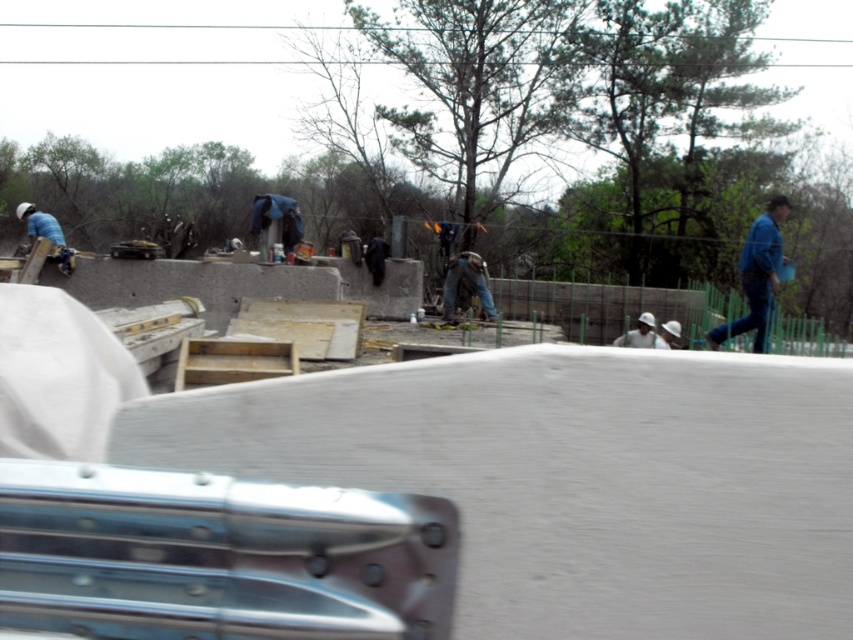
Between smooth concrete at center and blue denim jeans at right, which one appears on the left side from the viewer's perspective?

smooth concrete at center

You are a GUI agent. You are given a task and a screenshot of the screen. Output one action in this format:
    pyautogui.click(x=<x>, y=<y>)
    Task: Click on the smooth concrete at center
    The height and width of the screenshot is (640, 853).
    Given the screenshot: What is the action you would take?
    pyautogui.click(x=570, y=477)